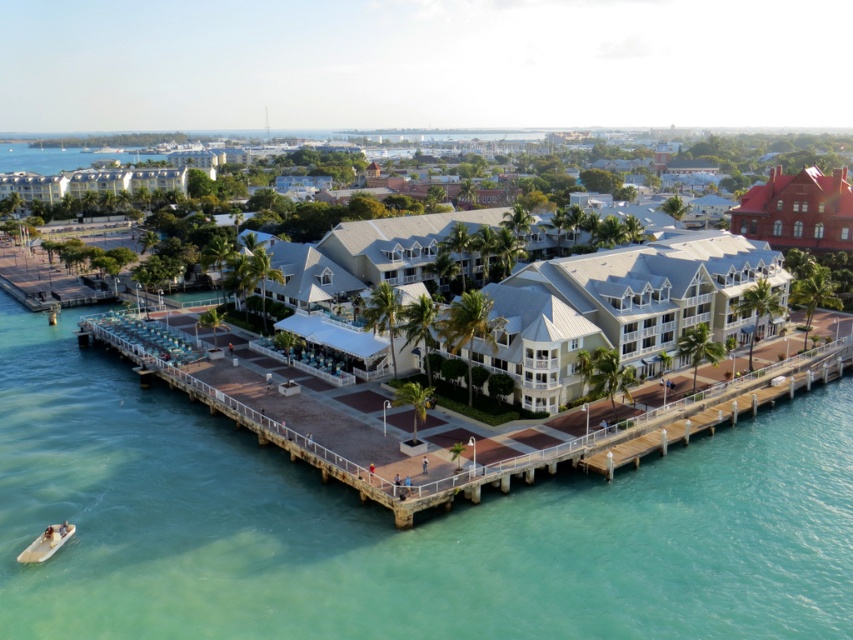
You are standing at the point labeled as point (476,465) in the image. Looking around, you see a white wooden dock at lower center. Which direction should you face to look towards the white wooden dock at lower center?

Since you are already at the point corresponding to the white wooden dock at lower center, you are already facing it or need to look down. The point (476,465) is exactly where the white wooden dock at lower center is located.

You are planning to install a wireless network between the light beige stucco building at center and the red brick building at upper right. The network requires a direct line of sight and a maximum distance of 60 meters. Based on the scene, will the network setup be feasible?

The light beige stucco building at center and the red brick building at upper right are 63.27 meters apart, which exceeds the maximum distance of 60 meters required for the network setup. Therefore, the network setup will not be feasible.

You are standing at the point marked as point [489,362] on the map of the waterfront scene. If you look directly towards the wooden pier, which object from the scene would be closest to your line of sight?

The wooden pier is the closest object to your line of sight from point [489,362] since it is the main structure extending into the water and directly in front of the cluster of buildings where the point is located.